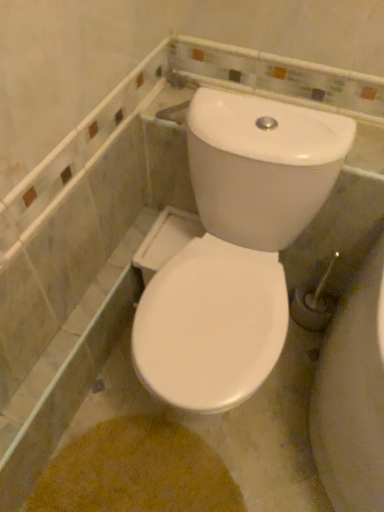
Where is `white glossy toilet at center`? Image resolution: width=384 pixels, height=512 pixels. white glossy toilet at center is located at coordinates (235, 248).

Describe the element at coordinates (235, 248) in the screenshot. I see `white glossy toilet at center` at that location.

This screenshot has width=384, height=512. Identify the location of white glossy toilet at center. (235, 248).